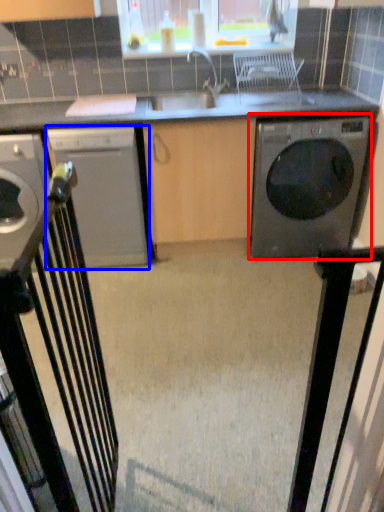
Question: Which point is closer to the camera, washing machine (highlighted by a red box) or home appliance (highlighted by a blue box)?

Choices:
 (A) washing machine
 (B) home appliance

Answer: (A)